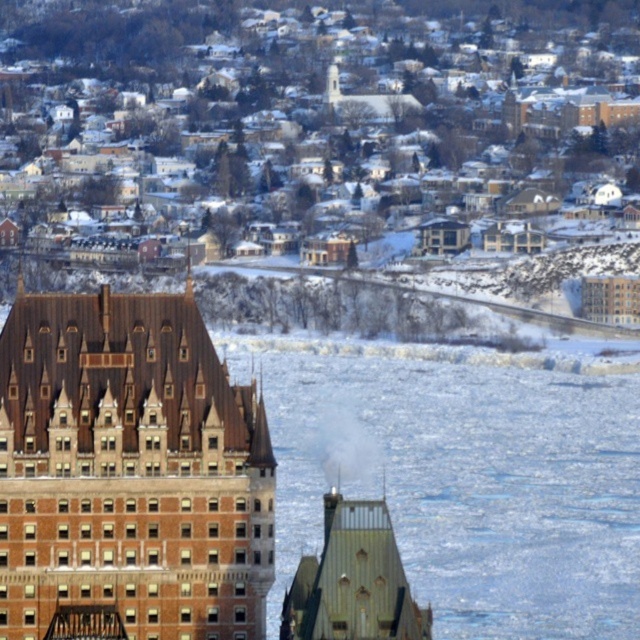
Based on the photo, is brown brick building at left further to the viewer compared to green metallic tower at center?

Yes, it is behind green metallic tower at center.

Where is `brown brick building at left`? The width and height of the screenshot is (640, 640). brown brick building at left is located at coordinates [x=129, y=470].

Does point (77, 362) lie behind point (408, 620)?

Yes, it is.

Locate an element on the screen. The image size is (640, 640). brown brick building at left is located at coordinates (129, 470).